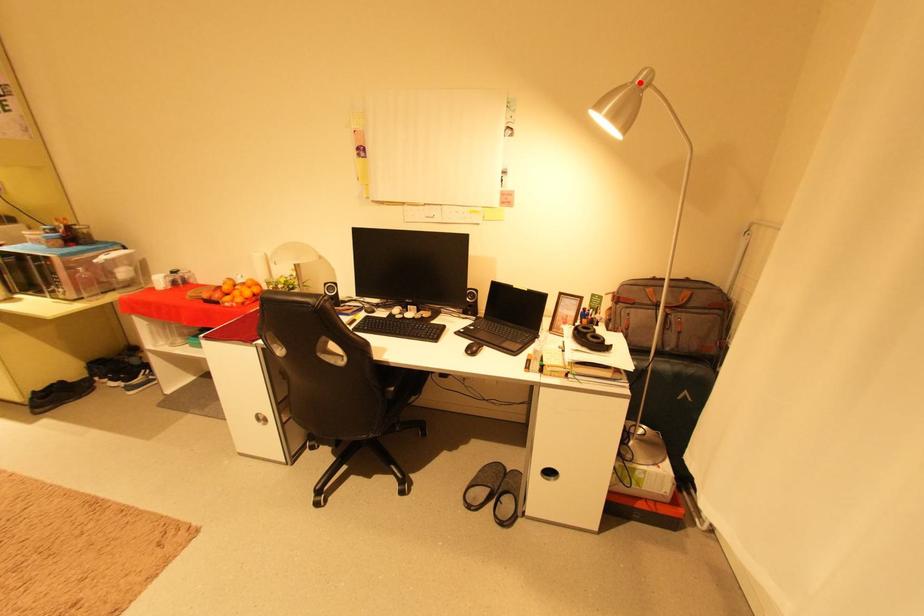
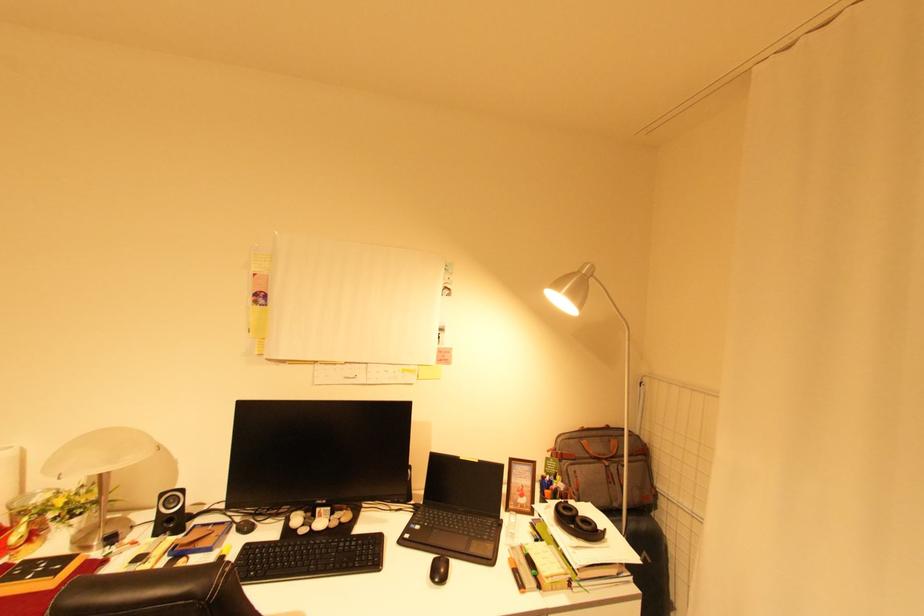
In the second image, find the point that corresponds to the highlighted location in the first image.

(587, 273)